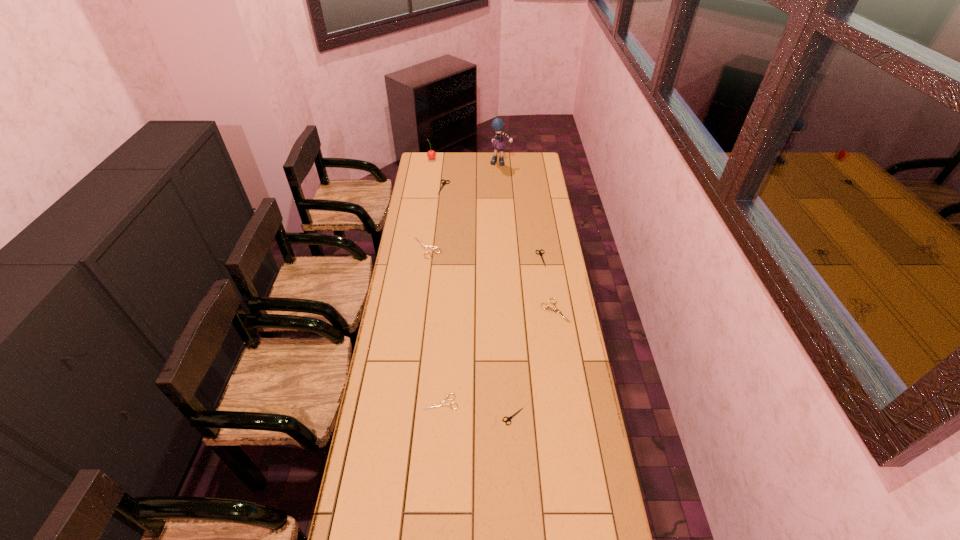
This screenshot has height=540, width=960. I want to click on black shears identified as the second closest to the blue rag doll, so click(540, 253).

The image size is (960, 540). What are the coordinates of `the closest black shears relative to the farthest beige shears` in the screenshot? It's located at (443, 183).

In order to click on beige shears that is the second closest to the cherry in this screenshot , I will do `click(548, 308)`.

Locate which beige shears ranks in proximity to the nearest beige shears. Please provide its 2D coordinates. Your answer should be formatted as a tuple, i.e. [(x, y)], where the tuple contains the x and y coordinates of a point satisfying the conditions above.

[(548, 308)]

Image resolution: width=960 pixels, height=540 pixels. In order to click on free point that satisfies the following two spatial constraints: 1. on the front-facing side of the tallest object; 2. on the left side of the rightmost beige shears in this screenshot , I will do `click(510, 311)`.

Image resolution: width=960 pixels, height=540 pixels. In order to click on vacant region that satisfies the following two spatial constraints: 1. on the front side of the biggest beige shears; 2. on the left side of the cherry in this screenshot , I will do `click(419, 247)`.